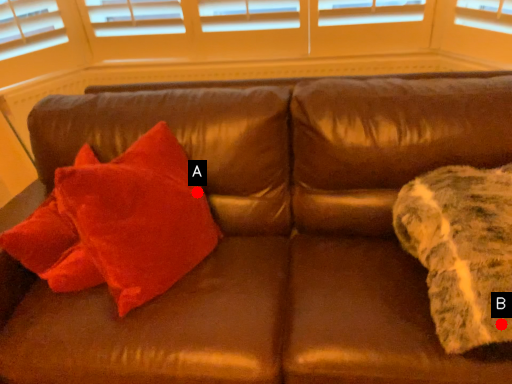
Question: Two points are circled on the image, labeled by A and B beside each circle. Which point is farther from the camera taking this photo?

Choices:
 (A) A is further
 (B) B is further

Answer: (A)